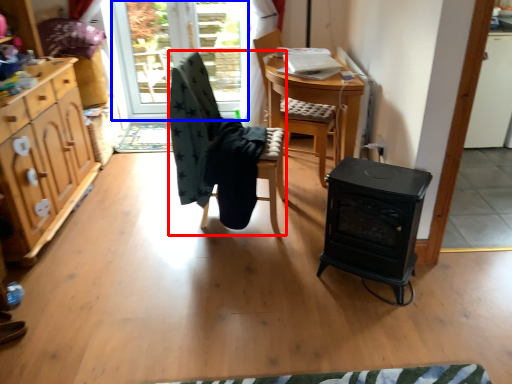
Question: Which object is closer to the camera taking this photo, chair (highlighted by a red box) or window screen (highlighted by a blue box)?

Choices:
 (A) chair
 (B) window screen

Answer: (A)